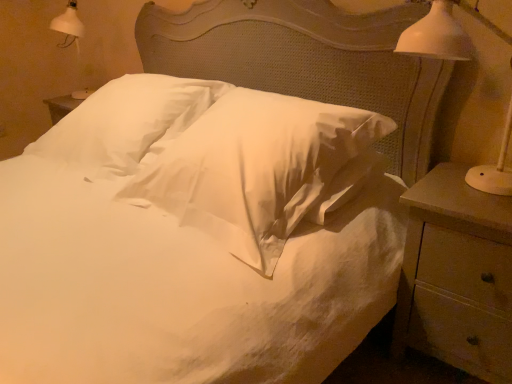
Where is `white soft pillow at center, placed as the 1th pillow when sorted from left to right`? white soft pillow at center, placed as the 1th pillow when sorted from left to right is located at coordinates (126, 123).

I want to click on white ceramic lamp at right, so pyautogui.click(x=443, y=33).

Which point is more distant from viewer, (502, 180) or (463, 288)?

Positioned behind is point (502, 180).

Is white ceramic lamp at right positioned far away from wooden nightstand at right?

That's not correct — white ceramic lamp at right is a little close to wooden nightstand at right.

Can you confirm if white ceramic lamp at right is taller than wooden nightstand at right?

No.

Is white ceramic lamp at right facing towards white satin pillow at center, which is the second pillow in left-to-right order?

No, white ceramic lamp at right is not turned towards white satin pillow at center, which is the second pillow in left-to-right order.

How distant is white ceramic lamp at right from white satin pillow at center, which is the second pillow in left-to-right order?

The distance of white ceramic lamp at right from white satin pillow at center, which is the second pillow in left-to-right order, is 19.56 inches.

Between point (504, 151) and point (281, 199), which one is positioned behind?

Positioned behind is point (504, 151).

From the picture: From the image's perspective, is white ceramic lamp at right beneath white satin pillow at center, which is counted as the 1th pillow, starting from the right?

No, from the image's perspective, white ceramic lamp at right is not beneath white satin pillow at center, which is counted as the 1th pillow, starting from the right.

Is point (424, 288) closer or farther from the camera than point (222, 212)?

Point (424, 288) is farther from the camera than point (222, 212).

Between wooden nightstand at right and white satin pillow at center, which is counted as the 1th pillow, starting from the right, which one appears on the left side from the viewer's perspective?

From the viewer's perspective, white satin pillow at center, which is counted as the 1th pillow, starting from the right, appears more on the left side.

Based on the photo, does wooden nightstand at right have a lesser width compared to white satin pillow at center, which is the second pillow in left-to-right order?

Yes, wooden nightstand at right is thinner than white satin pillow at center, which is the second pillow in left-to-right order.

Does wooden nightstand at right turn towards white soft pillow at center, placed as the 1th pillow when sorted from left to right?

No, wooden nightstand at right is not turned towards white soft pillow at center, placed as the 1th pillow when sorted from left to right.

Considering the positions of point (400, 296) and point (193, 109), is point (400, 296) closer or farther from the camera than point (193, 109)?

Point (400, 296) is positioned closer to the camera compared to point (193, 109).

Relative to white soft pillow at center, placed as the 1th pillow when sorted from left to right, is wooden nightstand at right in front or behind?

Clearly, wooden nightstand at right is in front of white soft pillow at center, placed as the 1th pillow when sorted from left to right.

Is wooden nightstand at right touching white soft pillow at center, which is the second pillow from right to left?

They are not placed beside each other.

From the image's perspective, is white soft pillow at center, which is the second pillow from right to left, over white ceramic lamp at right?

Yes, from the image's perspective, white soft pillow at center, which is the second pillow from right to left, is over white ceramic lamp at right.

This screenshot has height=384, width=512. Find the location of `bedside lamp above the white soft pillow at center, placed as the 1th pillow when sorted from left to right (from a real-world perspective)`. bedside lamp above the white soft pillow at center, placed as the 1th pillow when sorted from left to right (from a real-world perspective) is located at coordinates (443, 33).

How distant is white soft pillow at center, which is the second pillow from right to left, from white ceramic lamp at right?

white soft pillow at center, which is the second pillow from right to left, and white ceramic lamp at right are 3.73 feet apart.

From their relative heights in the image, would you say white soft pillow at center, which is the second pillow from right to left, is taller or shorter than white ceramic lamp at right?

Clearly, white soft pillow at center, which is the second pillow from right to left, is shorter compared to white ceramic lamp at right.

Can you tell me how much white satin pillow at center, which is the second pillow in left-to-right order, and white ceramic lamp at right differ in facing direction?

0.639 degrees.

Can you confirm if white satin pillow at center, which is counted as the 1th pillow, starting from the right, is smaller than white ceramic lamp at right?

No.

Considering the positions of objects white satin pillow at center, which is counted as the 1th pillow, starting from the right, and white ceramic lamp at right in the image provided, who is in front, white satin pillow at center, which is counted as the 1th pillow, starting from the right, or white ceramic lamp at right?

white ceramic lamp at right is in front.

Is white satin pillow at center, which is the second pillow in left-to-right order, facing away from wooden nightstand at right?

No, white satin pillow at center, which is the second pillow in left-to-right order,'s orientation is not away from wooden nightstand at right.

Is white satin pillow at center, which is the second pillow in left-to-right order, bigger or smaller than wooden nightstand at right?

white satin pillow at center, which is the second pillow in left-to-right order, is bigger than wooden nightstand at right.

In the scene shown: From a real-world perspective, which object rests below the other?

wooden nightstand at right, from a real-world perspective.

Can you confirm if white satin pillow at center, which is counted as the 1th pillow, starting from the right, is thinner than wooden nightstand at right?

No, white satin pillow at center, which is counted as the 1th pillow, starting from the right, is not thinner than wooden nightstand at right.

Locate an element on the screen. nightstand behind the white ceramic lamp at right is located at coordinates (457, 276).

Locate an element on the screen. bedside lamp located on the right of white satin pillow at center, which is the second pillow in left-to-right order is located at coordinates (443, 33).

Looking at the image, which one is located closer to white soft pillow at center, which is the second pillow from right to left, wooden nightstand at right or white ceramic lamp at right?

wooden nightstand at right.

Which object lies nearer to the anchor point white satin pillow at center, which is the second pillow in left-to-right order, white ceramic lamp at right or white soft pillow at center, placed as the 1th pillow when sorted from left to right?

white soft pillow at center, placed as the 1th pillow when sorted from left to right, is positioned closer to the anchor white satin pillow at center, which is the second pillow in left-to-right order.

In the scene shown: Which object lies nearer to the anchor point white ceramic lamp at right, wooden nightstand at right or white satin pillow at center, which is the second pillow in left-to-right order?

The object closer to white ceramic lamp at right is wooden nightstand at right.

Which object lies nearer to the anchor point white ceramic lamp at right, white soft pillow at center, placed as the 1th pillow when sorted from left to right, or white satin pillow at center, which is counted as the 1th pillow, starting from the right?

The object closer to white ceramic lamp at right is white satin pillow at center, which is counted as the 1th pillow, starting from the right.

In the scene shown: When comparing their distances from wooden nightstand at right, does white ceramic lamp at right or white satin pillow at center, which is the second pillow in left-to-right order, seem closer?

white ceramic lamp at right.

Which object lies further to the anchor point white satin pillow at center, which is the second pillow in left-to-right order, white soft pillow at center, which is the second pillow from right to left, or white ceramic lamp at right?

white ceramic lamp at right is further to white satin pillow at center, which is the second pillow in left-to-right order.

Estimate the real-world distances between objects in this image. Which object is closer to white satin pillow at center, which is counted as the 1th pillow, starting from the right, white ceramic lamp at right or wooden nightstand at right?

wooden nightstand at right is positioned closer to the anchor white satin pillow at center, which is counted as the 1th pillow, starting from the right.

Estimate the real-world distances between objects in this image. Which object is closer to white soft pillow at center, which is the second pillow from right to left, white satin pillow at center, which is counted as the 1th pillow, starting from the right, or white ceramic lamp at right?

Based on the image, white satin pillow at center, which is counted as the 1th pillow, starting from the right, appears to be nearer to white soft pillow at center, which is the second pillow from right to left.

Image resolution: width=512 pixels, height=384 pixels. Identify the location of pillow situated between white soft pillow at center, placed as the 1th pillow when sorted from left to right, and white ceramic lamp at right from left to right. (260, 169).

Find the location of a particular element. The height and width of the screenshot is (384, 512). bedside lamp between white soft pillow at center, placed as the 1th pillow when sorted from left to right, and wooden nightstand at right from left to right is located at coordinates (443, 33).

Find the location of a particular element. bedside lamp between white satin pillow at center, which is the second pillow in left-to-right order, and wooden nightstand at right from left to right is located at coordinates (443, 33).

Identify the location of pillow between white soft pillow at center, placed as the 1th pillow when sorted from left to right, and wooden nightstand at right. The height and width of the screenshot is (384, 512). (260, 169).